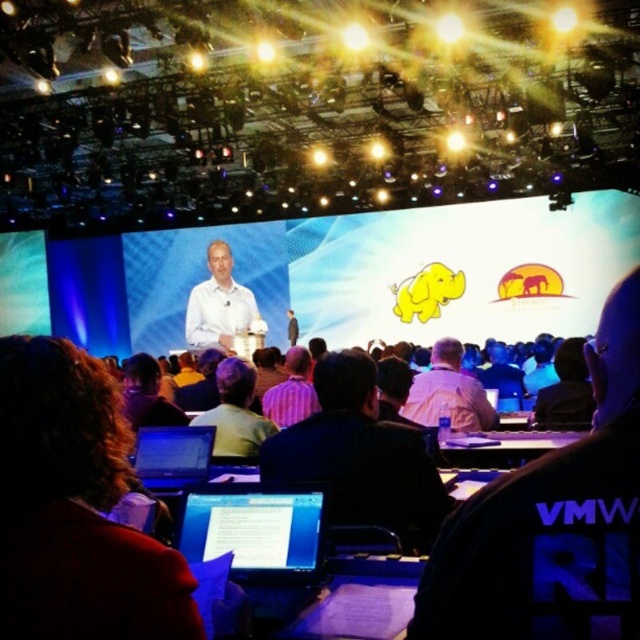
Question: Is the position of purple shirt at center less distant than that of matte black laptop at center?

Choices:
 (A) no
 (B) yes

Answer: (A)

Question: From the image, what is the correct spatial relationship of light blue shirt at center in relation to white shirt at center?

Choices:
 (A) below
 (B) above

Answer: (B)

Question: Which point appears closest to the camera in this image?

Choices:
 (A) (492, 376)
 (B) (456, 420)
 (C) (392, 451)
 (D) (532, 500)

Answer: (D)

Question: Which is farther from the purple shirt at center?

Choices:
 (A) white matte shirt at center
 (B) matte black shirt at center
 (C) black glossy laptop at center
 (D) white shirt at center

Answer: (A)

Question: Does brown hair at center appear on the left side of white shirt at center?

Choices:
 (A) no
 (B) yes

Answer: (B)

Question: Which point is closer to the camera taking this photo?

Choices:
 (A) (253, 314)
 (B) (508, 531)

Answer: (B)